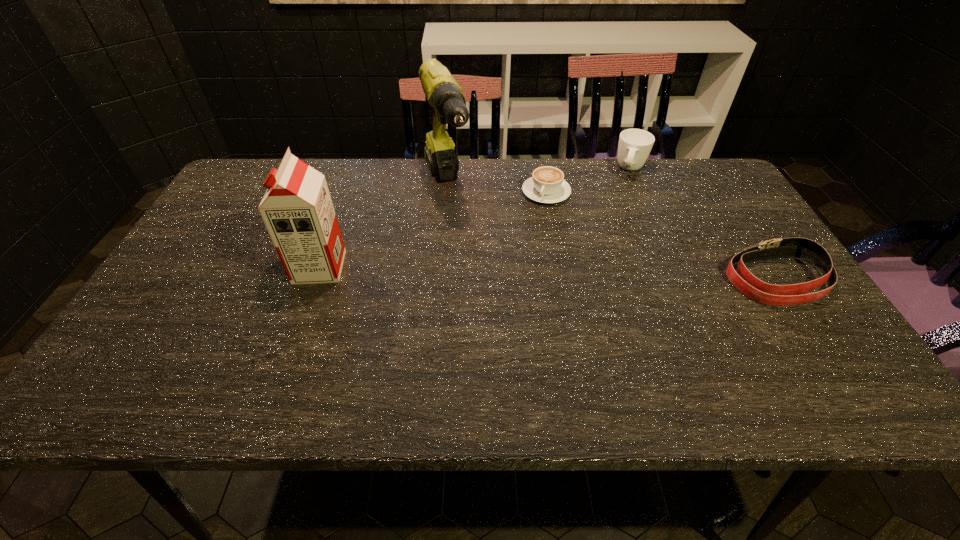
Find the location of `soya milk`. soya milk is located at coordinates (297, 209).

At what (x,y) coordinates should I click in order to perform the action: click on the rightmost object. Please return your answer as a coordinate pair (x, y). Image resolution: width=960 pixels, height=540 pixels. Looking at the image, I should click on (743, 280).

Identify the location of dog collar. (743, 280).

In order to click on cappuccino in this screenshot , I will do `click(547, 185)`.

Where is `the shortest object`? The image size is (960, 540). the shortest object is located at coordinates (547, 185).

This screenshot has width=960, height=540. I want to click on the second object from left to right, so 444,94.

This screenshot has height=540, width=960. In order to click on cup in this screenshot , I will do `click(634, 147)`.

Locate an element on the screen. The image size is (960, 540). the third tallest object is located at coordinates (634, 147).

Locate an element on the screen. This screenshot has width=960, height=540. free space located on the front of the leftmost object is located at coordinates (288, 355).

Where is `free space located 0.240m on the left of the rightmost object`? The height and width of the screenshot is (540, 960). free space located 0.240m on the left of the rightmost object is located at coordinates (628, 280).